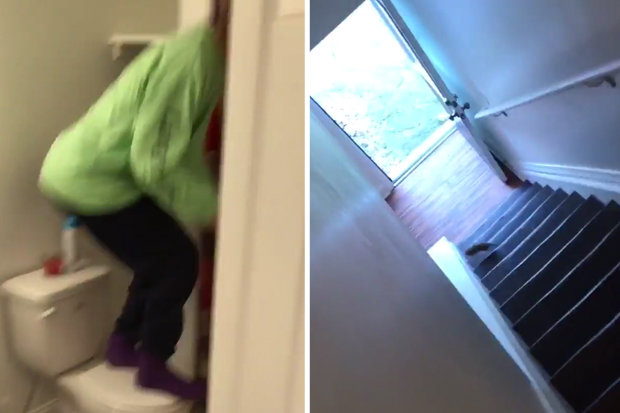
Where is `brackets`? This screenshot has height=413, width=620. brackets is located at coordinates (609, 80), (497, 116).